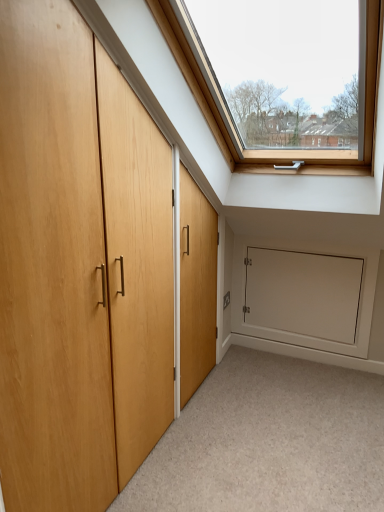
Locate an element on the screen. vacant space underneath light wood door at left (from a real-world perspective) is located at coordinates pos(167,431).